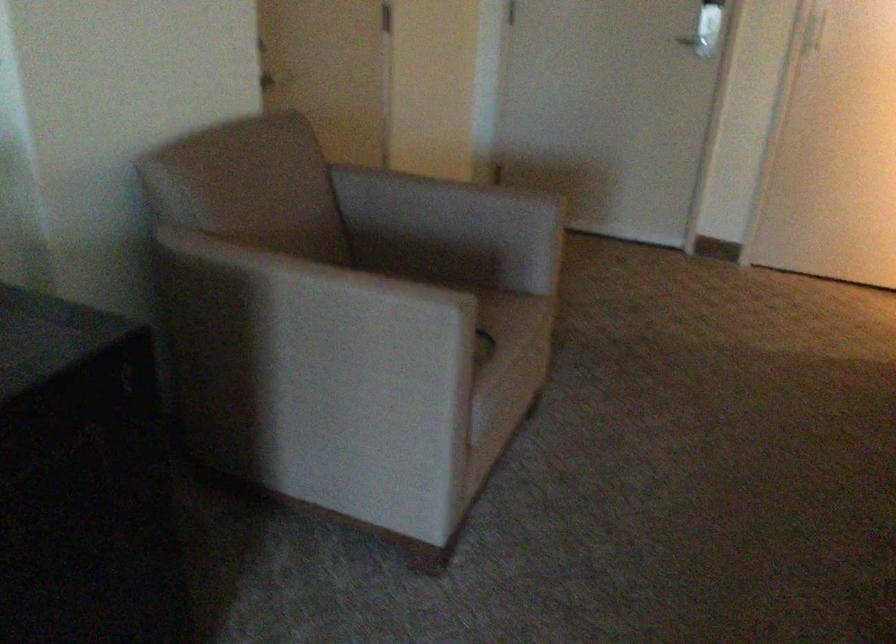
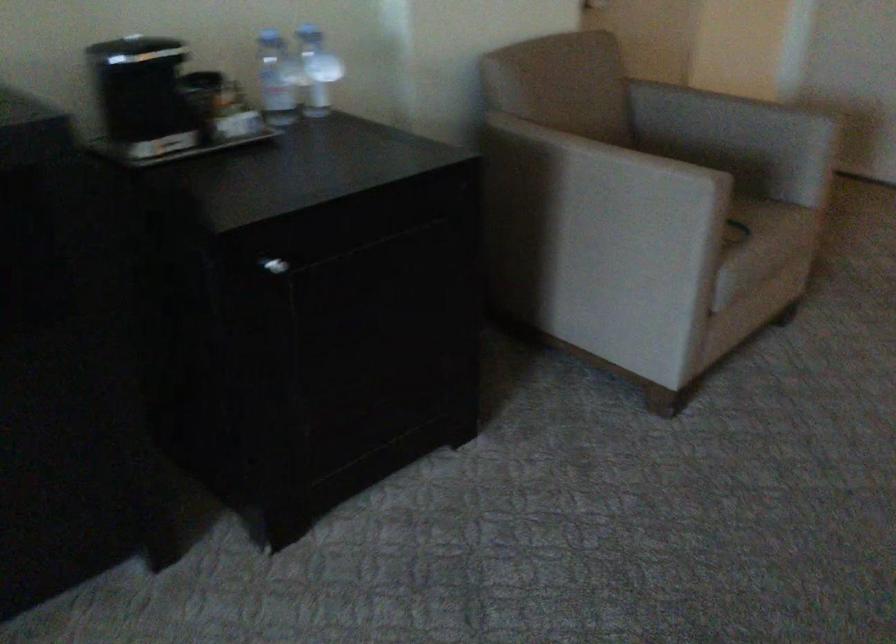
Question: Based on the continuous images, in which direction is the camera rotating? Reply with the corresponding letter.

Choices:
 (A) Left
 (B) Right
 (C) Up
 (D) Down

Answer: (A)